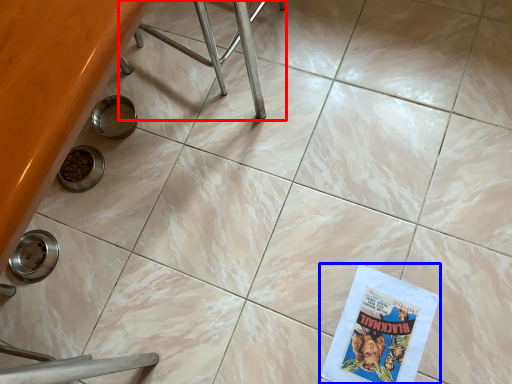
Question: Among these objects, which one is nearest to the camera, furniture (highlighted by a red box) or comic book (highlighted by a blue box)?

Choices:
 (A) furniture
 (B) comic book

Answer: (A)